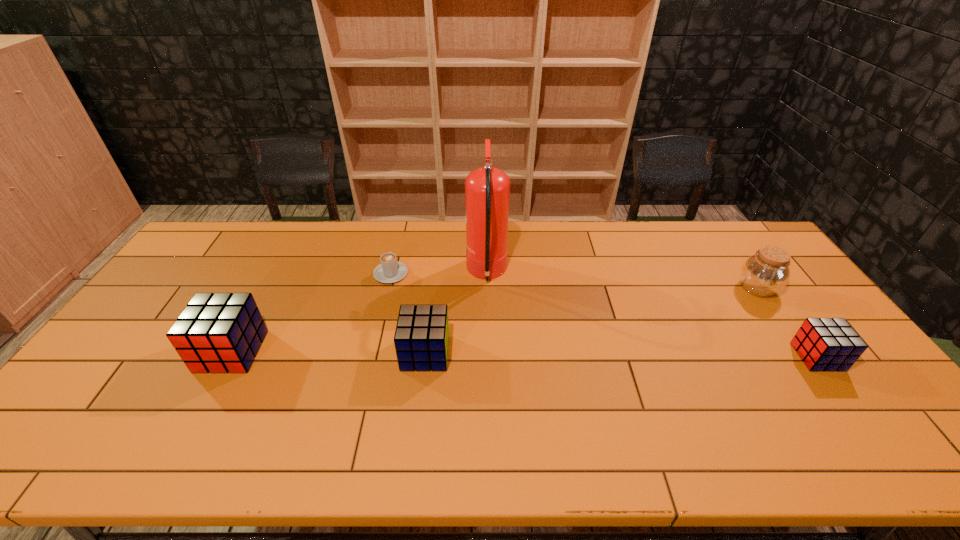
Image resolution: width=960 pixels, height=540 pixels. I want to click on the tallest cube, so click(x=216, y=332).

At what (x,y) coordinates should I click in order to perform the action: click on the leftmost object. Please return your answer as a coordinate pair (x, y). Image resolution: width=960 pixels, height=540 pixels. Looking at the image, I should click on (216, 332).

Where is `the second tallest cube`? Image resolution: width=960 pixels, height=540 pixels. the second tallest cube is located at coordinates (421, 339).

Where is `the second cube from left to right`? the second cube from left to right is located at coordinates (421, 339).

Locate an element on the screen. The width and height of the screenshot is (960, 540). the second shortest object is located at coordinates (824, 344).

Identify the location of the shortest cube. The height and width of the screenshot is (540, 960). (824, 344).

Where is `the fifth object from right to left`? The height and width of the screenshot is (540, 960). the fifth object from right to left is located at coordinates 390,270.

This screenshot has width=960, height=540. I want to click on cappuccino, so click(x=390, y=270).

At what (x,y) coordinates should I click in order to perform the action: click on the third object from right to left. Please return your answer as a coordinate pair (x, y). This screenshot has height=540, width=960. Looking at the image, I should click on (487, 189).

The height and width of the screenshot is (540, 960). I want to click on the tallest object, so click(487, 189).